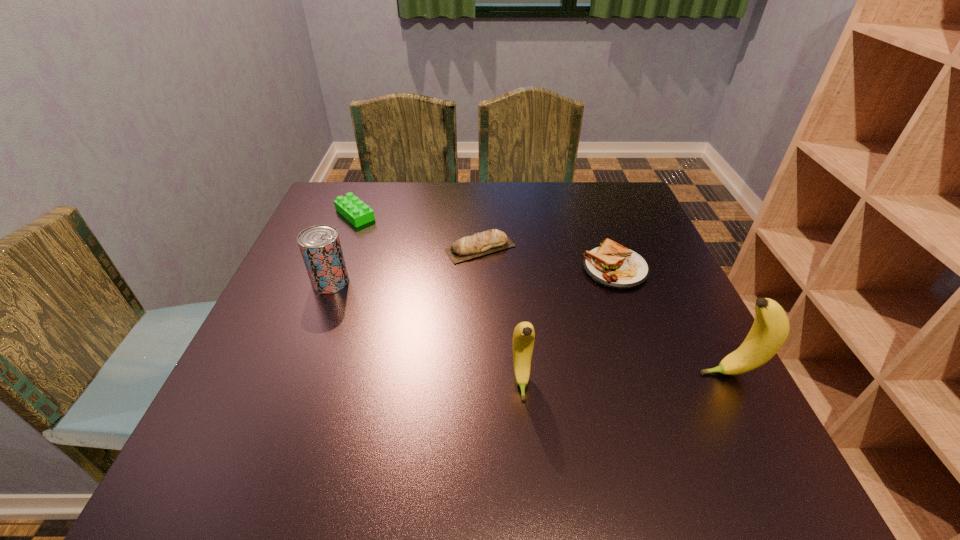
Find the location of a particular element. The image size is (960, 540). vacant area between the pita bread and the rightmost object is located at coordinates (605, 310).

The image size is (960, 540). In order to click on vacant area between the left banana and the taller banana in this screenshot , I will do `click(625, 377)`.

The width and height of the screenshot is (960, 540). Find the location of `empty space between the pita bread and the taller banana`. empty space between the pita bread and the taller banana is located at coordinates tap(605, 310).

Where is `empty location between the Lego and the pita bread`? The image size is (960, 540). empty location between the Lego and the pita bread is located at coordinates (418, 231).

Locate an element on the screen. This screenshot has height=540, width=960. vacant space in between the pita bread and the beer can is located at coordinates (405, 265).

Locate an element on the screen. object identified as the third closest to the pita bread is located at coordinates click(320, 246).

Identify the location of object that is the closest one to the left banana. (613, 265).

The width and height of the screenshot is (960, 540). Find the location of `vacant point that satisfies the following two spatial constraints: 1. on the back side of the pita bread; 2. on the left side of the third tallest object`. vacant point that satisfies the following two spatial constraints: 1. on the back side of the pita bread; 2. on the left side of the third tallest object is located at coordinates (344, 248).

What are the coordinates of `free location that satisfies the following two spatial constraints: 1. on the back side of the third tallest object; 2. on the right side of the fifth object from left to right` in the screenshot? It's located at (336, 269).

Identify the location of blank space that satisfies the following two spatial constraints: 1. on the front side of the pita bread; 2. on the left side of the fifth object from left to right. (480, 269).